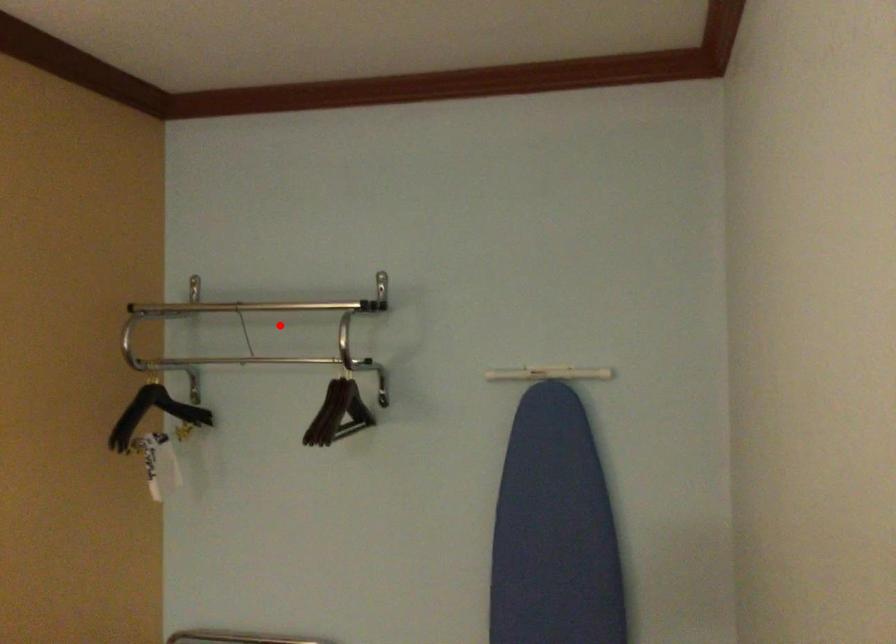
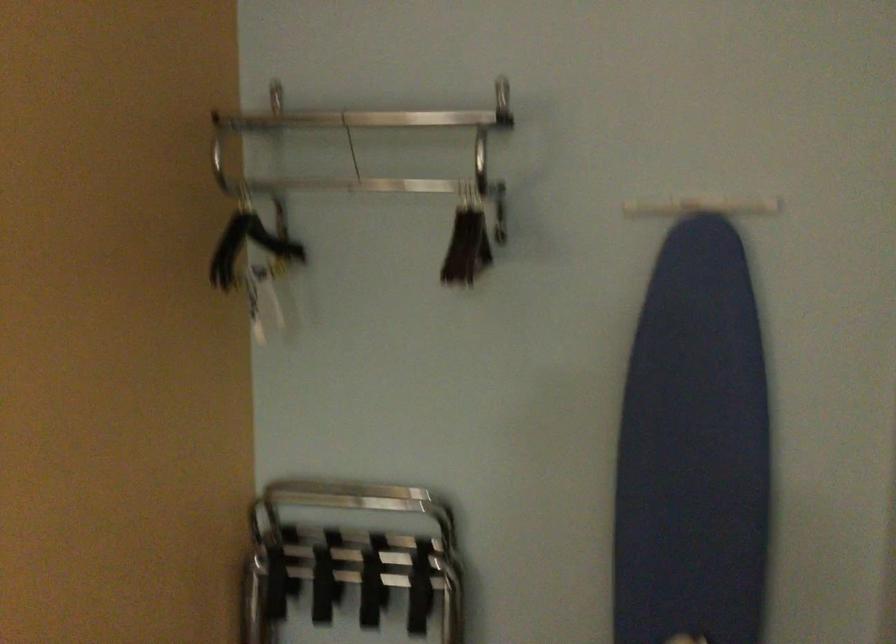
Question: I am providing you with two images of the same scene from different viewpoints. Image1 has a red point marked. In image2, the corresponding 3D location appears at what relative position? Reply with the corresponding letter.

Choices:
 (A) Closer
 (B) Farther

Answer: (A)